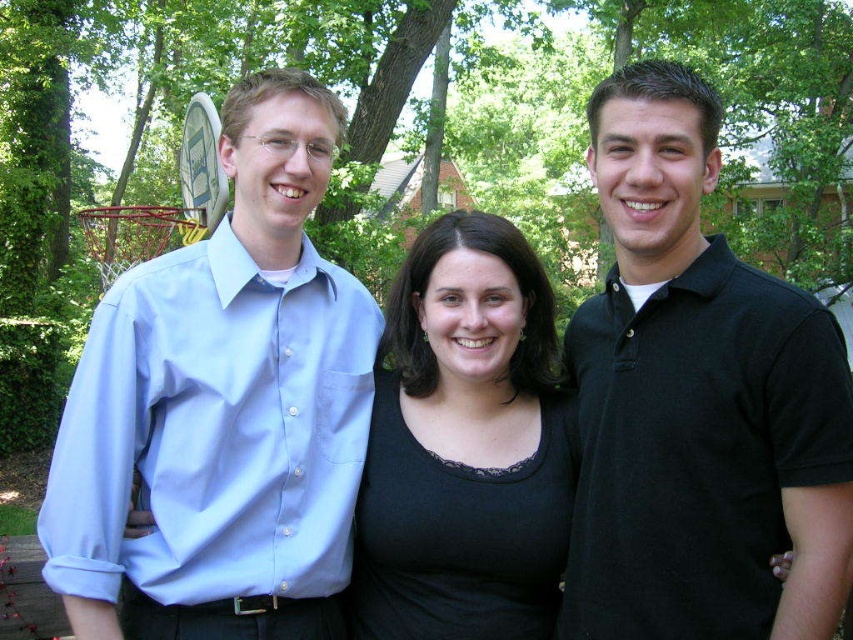
Question: Which point appears closest to the camera in this image?

Choices:
 (A) (799, 440)
 (B) (492, 429)
 (C) (223, 588)

Answer: (A)

Question: Based on their relative distances, which object is farther from the black matte shirt at center?

Choices:
 (A) light blue cotton shirt at left
 (B) black polo shirt at right

Answer: (A)

Question: Considering the real-world distances, which object is closest to the black polo shirt at right?

Choices:
 (A) light blue cotton shirt at left
 (B) black matte shirt at center

Answer: (B)

Question: Can you confirm if light blue cotton shirt at left is wider than black polo shirt at right?

Choices:
 (A) yes
 (B) no

Answer: (A)

Question: Is light blue cotton shirt at left positioned before black matte shirt at center?

Choices:
 (A) yes
 (B) no

Answer: (A)

Question: Does light blue cotton shirt at left appear under black matte shirt at center?

Choices:
 (A) yes
 (B) no

Answer: (B)